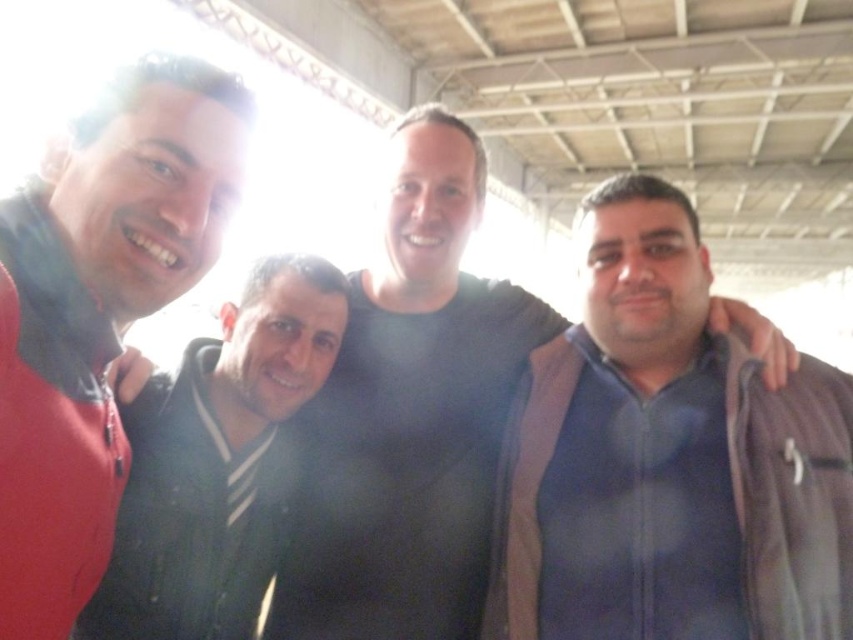
Is point (695, 556) closer to viewer compared to point (38, 524)?

No, (695, 556) is further to viewer.

Does dark blue zip-up jacket at right have a smaller size compared to matte red jacket at left?

No.

Is point (660, 246) in front of point (51, 173)?

No, it is behind (51, 173).

The width and height of the screenshot is (853, 640). In order to click on dark blue zip-up jacket at right in this screenshot , I will do `click(666, 460)`.

Is black matte shirt at center taller than matte red jacket at left?

Indeed, black matte shirt at center has a greater height compared to matte red jacket at left.

Does point (312, 579) lie behind point (149, 115)?

Yes, it is.

Where is `black matte shirt at center`? The height and width of the screenshot is (640, 853). black matte shirt at center is located at coordinates (408, 417).

Who is higher up, matte red jacket at left or dark gray hoodie at center?

matte red jacket at left is above.

Between point (163, 163) and point (250, 392), which one is positioned behind?

The point (250, 392) is behind.

Between point (100, 384) and point (111, 556), which one is positioned in front?

Point (100, 384)

This screenshot has width=853, height=640. What are the coordinates of `matte red jacket at left` in the screenshot? It's located at (97, 308).